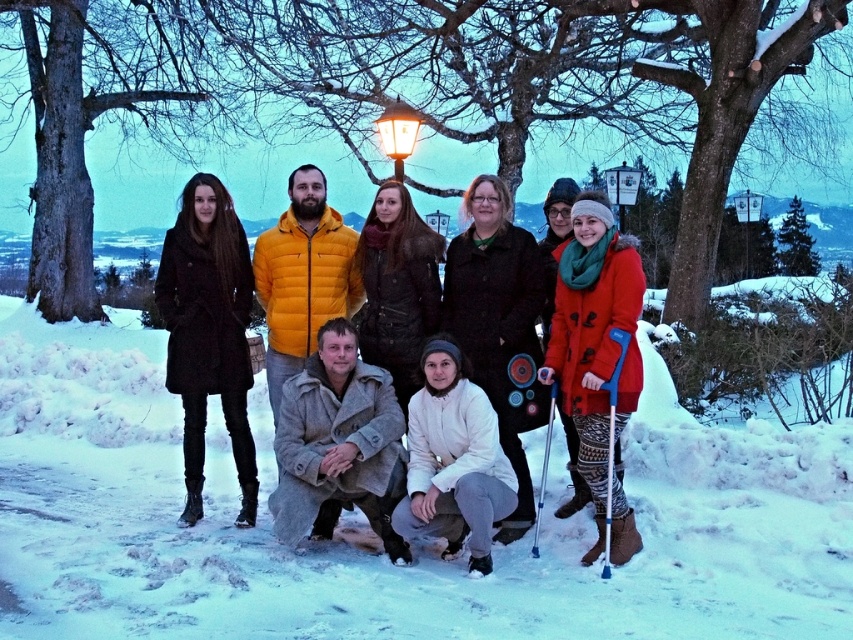
Question: Where is white fleece jacket at lower center located in relation to metallic blue ski pole at lower center in the image?

Choices:
 (A) above
 (B) below

Answer: (A)

Question: Which point appears closest to the camera in this image?

Choices:
 (A) (306, 432)
 (B) (471, 388)
 (C) (544, 486)

Answer: (B)

Question: Can you confirm if white fleece jacket at center is positioned to the right of metallic blue ski pole at lower center?

Choices:
 (A) no
 (B) yes

Answer: (A)

Question: Which object is farther from the camera taking this photo?

Choices:
 (A) orange fuzzy coat at right
 (B) white fleece jacket at lower center
 (C) metallic blue ski pole at lower center
 (D) white fleece jacket at center

Answer: (D)

Question: Can you confirm if orange fuzzy coat at right is wider than white fleece jacket at center?

Choices:
 (A) yes
 (B) no

Answer: (B)

Question: Which object appears farthest from the camera in this image?

Choices:
 (A) blue metallic crutches at lower right
 (B) matte black coat at left
 (C) metallic blue ski pole at lower center

Answer: (B)